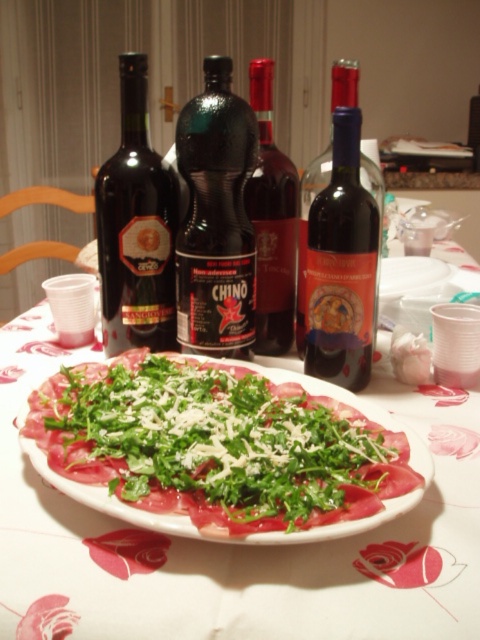
In the scene shown: You are a server at a restaurant. You need to place a new wine bottle on the table, but there is limited space between the dark glass wine bottle at center and the dark glass bottle at left. Can you fit a bottle that is 10 cm wide in that space?

The dark glass wine bottle at center is narrower than the dark glass bottle at left. The space between them would depend on their widths. Since the dark glass wine bottle at center is narrower, the space between them might be sufficient, but without exact measurements, it is hard to determine. However, the description only states the width comparison, not the distance between them. Therefore, the answer cannot be confirmed based on the given information.

You are a guest at a dinner party and want to place your napkin on the table without covering any items. Considering the green leafy salad at center and the black glass bottle at center, which item should you avoid placing the napkin over to ensure it doesn

The green leafy salad at center is taller than the black glass bottle at center, so placing the napkin over the salad would require covering it, which should be avoided. The black glass bottle at center is shorter, so placing the napkin there might be possible without covering it completely.